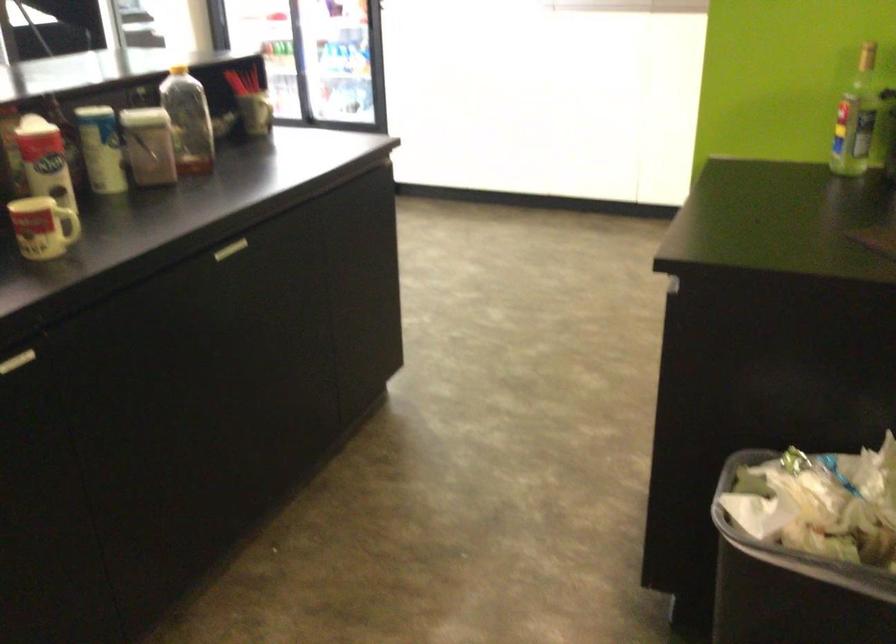
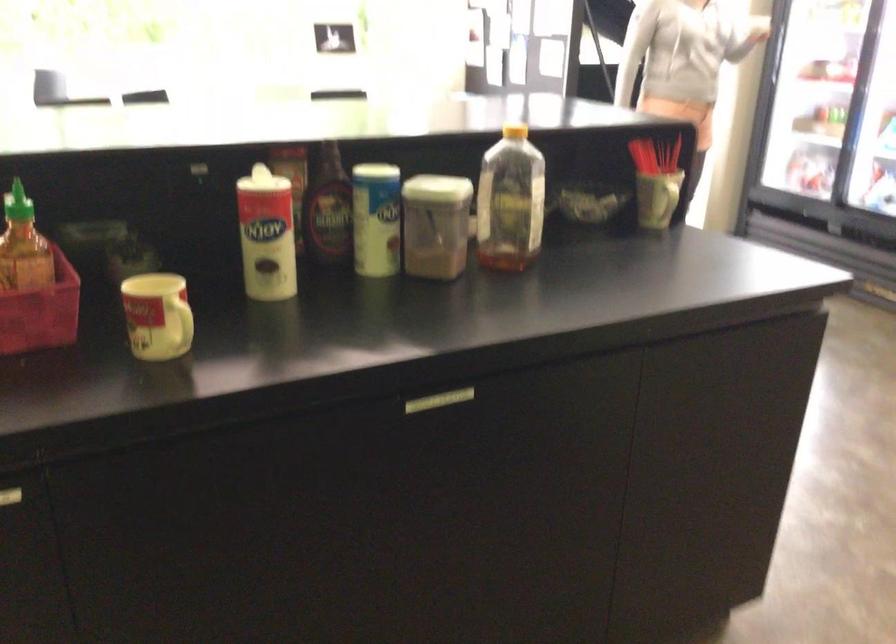
Question: The images are taken continuously from a first-person perspective. In which direction is your viewpoint rotating?

Choices:
 (A) Left
 (B) Right
 (C) Up
 (D) Down

Answer: (A)